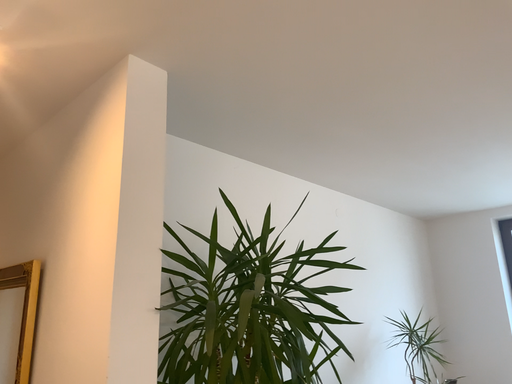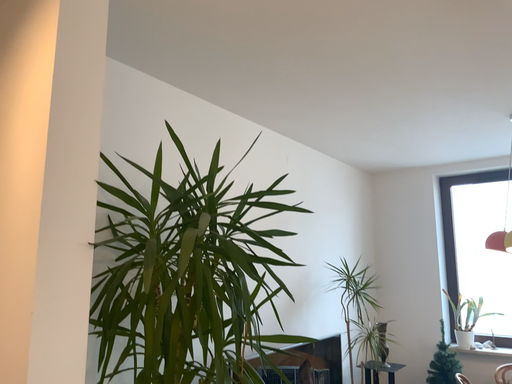
Question: Which way did the camera rotate in the video?

Choices:
 (A) rotated upward
 (B) rotated downward

Answer: (B)